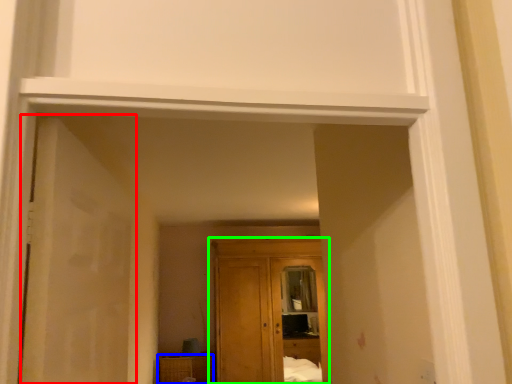
Question: Estimate the real-world distances between objects in this image. Which object is farther from door (highlighted by a red box), cabinetry (highlighted by a blue box) or cupboard (highlighted by a green box)?

Choices:
 (A) cabinetry
 (B) cupboard

Answer: (A)